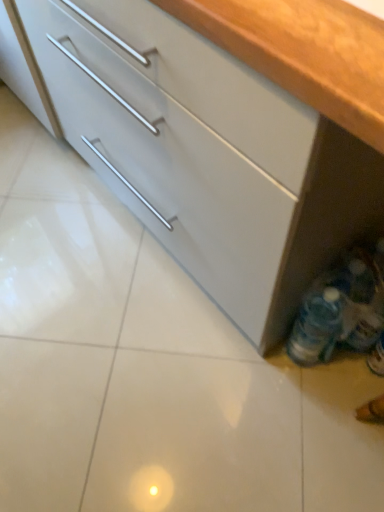
Image resolution: width=384 pixels, height=512 pixels. I want to click on free space in front of translucent plastic bottles at lower right, so click(335, 399).